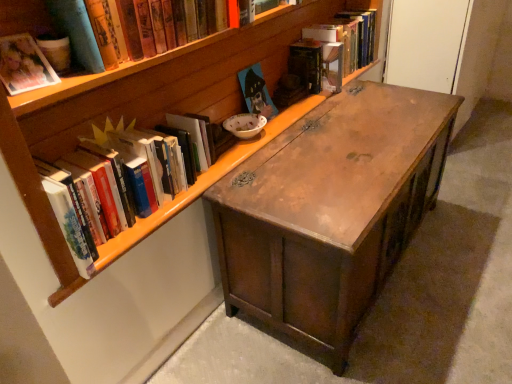
Question: Does hardcover book at upper right, which ranks as the first book in back-to-front order, lie behind hardcover book at upper center, which is the 5th book from front to back?

Choices:
 (A) no
 (B) yes

Answer: (B)

Question: Does hardcover book at upper right, which ranks as the 6th book in front-to-back order, have a lesser height compared to hardcover book at upper center, which is the 5th book from front to back?

Choices:
 (A) yes
 (B) no

Answer: (B)

Question: From a real-world perspective, does hardcover book at upper right, which ranks as the first book in back-to-front order, sit lower than hardcover book at upper center, which is the 5th book from front to back?

Choices:
 (A) yes
 (B) no

Answer: (B)

Question: Can you confirm if hardcover book at upper right, which ranks as the 6th book in front-to-back order, is taller than hardcover book at upper center, which is the second book in back-to-front order?

Choices:
 (A) yes
 (B) no

Answer: (A)

Question: Does hardcover book at upper right, which ranks as the first book in back-to-front order, have a smaller size compared to hardcover book at upper center, which is the second book in back-to-front order?

Choices:
 (A) no
 (B) yes

Answer: (A)

Question: From the image's perspective, is wooden desk at center located above or below hardcover books at left, the fourth book positioned from the back?

Choices:
 (A) below
 (B) above

Answer: (A)

Question: Considering their positions, is wooden desk at center located in front of or behind hardcover books at left, the fourth book positioned from the back?

Choices:
 (A) front
 (B) behind

Answer: (B)

Question: Considering the positions of wooden desk at center and hardcover books at left, the fourth book positioned from the back, in the image, is wooden desk at center taller or shorter than hardcover books at left, the fourth book positioned from the back,?

Choices:
 (A) short
 (B) tall

Answer: (B)

Question: Choose the correct answer: Is wooden desk at center inside hardcover books at left, which is the third book in front-to-back order, or outside it?

Choices:
 (A) outside
 (B) inside

Answer: (A)

Question: Would you say matte wooden painting at center, the third book in the back-to-front sequence, is to the left or to the right of matte cardboard book at upper left, the first book from the front, in the picture?

Choices:
 (A) left
 (B) right

Answer: (B)

Question: Considering their positions, is matte wooden painting at center, acting as the 4th book starting from the front, located in front of or behind matte cardboard book at upper left, the first book from the front?

Choices:
 (A) behind
 (B) front

Answer: (A)

Question: In terms of size, does matte wooden painting at center, acting as the 4th book starting from the front, appear bigger or smaller than matte cardboard book at upper left, the sixth book viewed from the back?

Choices:
 (A) big
 (B) small

Answer: (B)

Question: Is matte wooden painting at center, acting as the 4th book starting from the front, inside the boundaries of matte cardboard book at upper left, the first book from the front, or outside?

Choices:
 (A) outside
 (B) inside

Answer: (A)

Question: In terms of height, does hardcover book at upper center, which is the 5th book from front to back, look taller or shorter compared to matte wooden painting at center, the third book in the back-to-front sequence?

Choices:
 (A) short
 (B) tall

Answer: (B)

Question: Considering the positions of hardcover book at upper center, which is the 5th book from front to back, and matte wooden painting at center, acting as the 4th book starting from the front, in the image, is hardcover book at upper center, which is the 5th book from front to back, bigger or smaller than matte wooden painting at center, acting as the 4th book starting from the front,?

Choices:
 (A) big
 (B) small

Answer: (A)